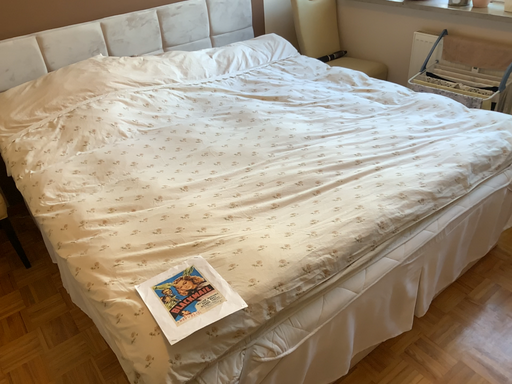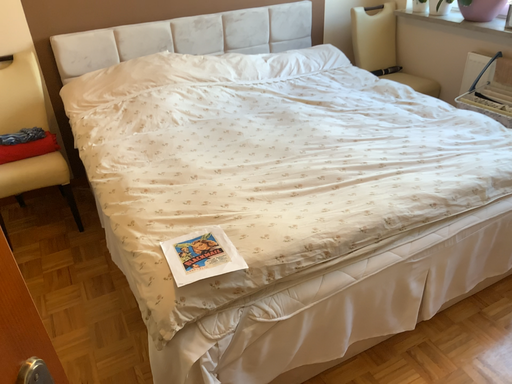
Question: How did the camera likely rotate when shooting the video?

Choices:
 (A) rotated right
 (B) rotated left

Answer: (B)